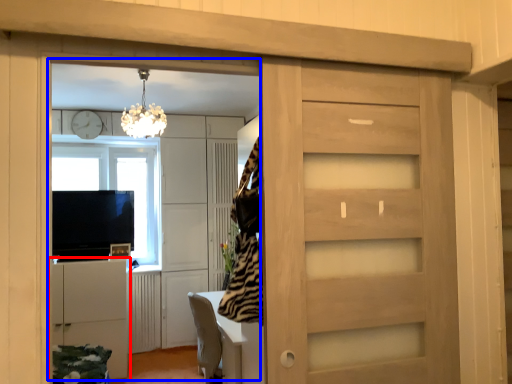
Question: Which object is closer to the camera taking this photo, cabinetry (highlighted by a red box) or entertainment center (highlighted by a blue box)?

Choices:
 (A) cabinetry
 (B) entertainment center

Answer: (B)